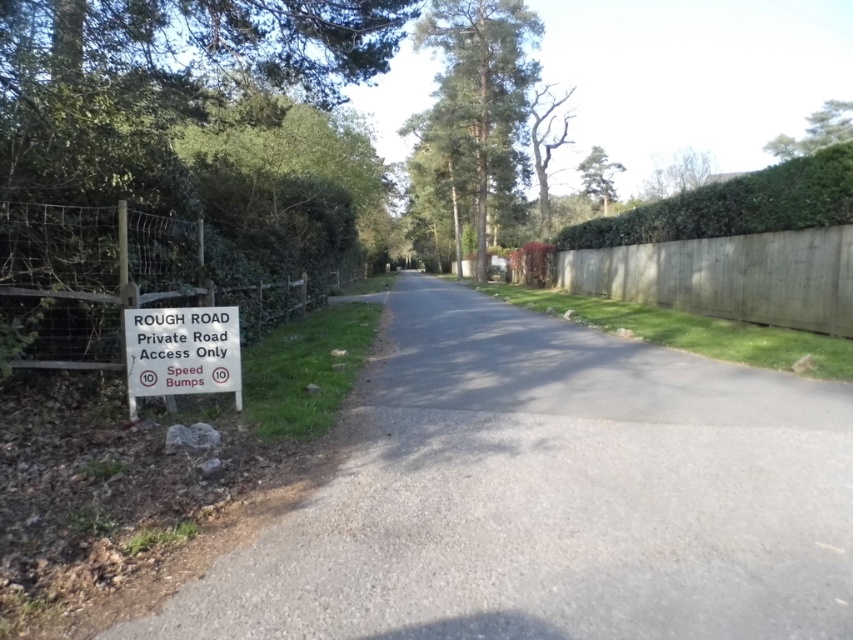
Does point (842, 228) lie behind point (178, 308)?

That is True.

Can you confirm if smooth wooden fence at right is taller than white plastic sign at left?

Yes, smooth wooden fence at right is taller than white plastic sign at left.

Where is `smooth wooden fence at right`? This screenshot has width=853, height=640. smooth wooden fence at right is located at coordinates (728, 276).

Where is `smooth wooden fence at right`? Image resolution: width=853 pixels, height=640 pixels. smooth wooden fence at right is located at coordinates (728, 276).

Is gray asphalt road at left bigger than white plastic sign at left?

Indeed, gray asphalt road at left has a larger size compared to white plastic sign at left.

Measure the distance between point [740,385] and camera.

They are 5.05 meters apart.

I want to click on gray asphalt road at left, so click(550, 497).

Is gray asphalt road at left positioned in front of green leafy hedge at upper right?

Yes, gray asphalt road at left is closer to the viewer.

Who is positioned more to the right, gray asphalt road at left or green leafy hedge at upper right?

Positioned to the right is green leafy hedge at upper right.

Is point (653, 476) positioned before point (659, 237)?

Yes, point (653, 476) is closer to viewer.

The width and height of the screenshot is (853, 640). I want to click on gray asphalt road at left, so click(550, 497).